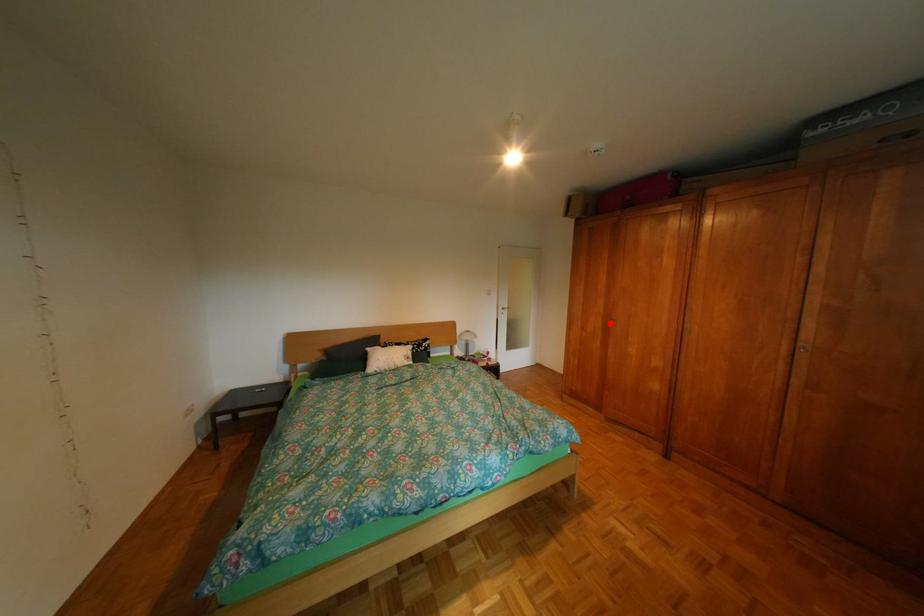
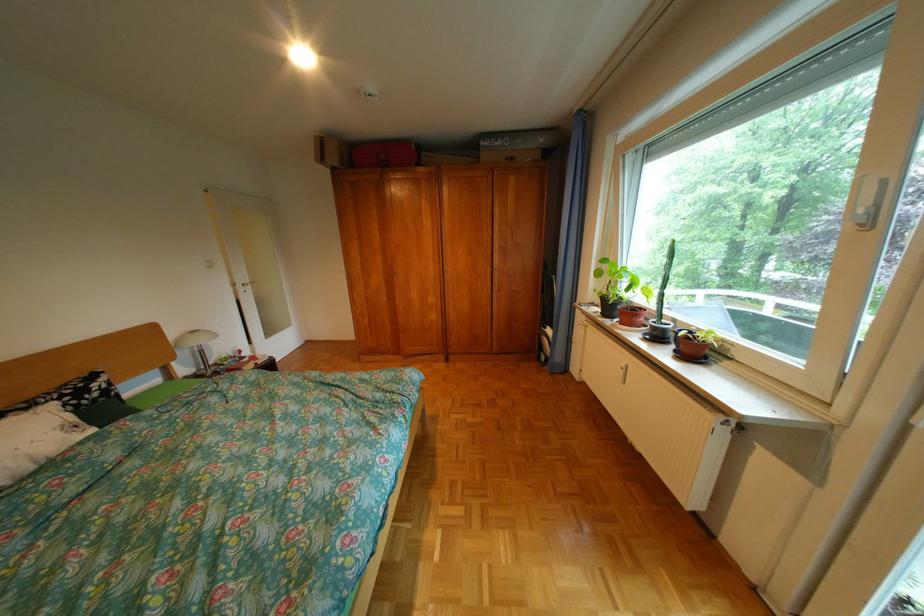
The point at the highlighted location is marked in the first image. Where is the corresponding point in the second image?

(392, 280)